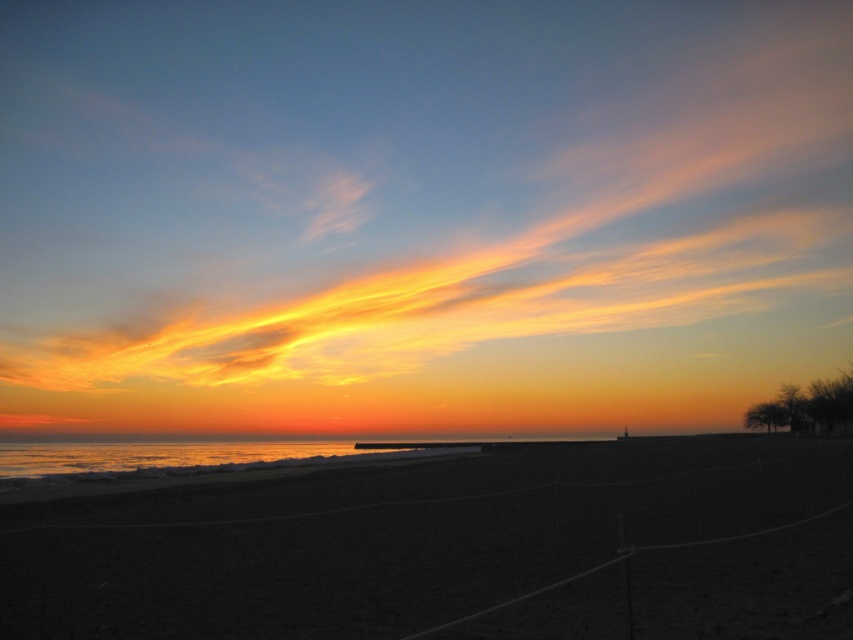
Question: Does golden translucent clouds at upper center appear on the right side of dark sand at center?

Choices:
 (A) no
 (B) yes

Answer: (A)

Question: Which point is farther to the camera?

Choices:
 (A) (711, 570)
 (B) (480, 196)

Answer: (B)

Question: In this image, where is golden translucent clouds at upper center located relative to dark sand at center?

Choices:
 (A) left
 (B) right

Answer: (A)

Question: Which point is farther from the camera taking this photo?

Choices:
 (A) (703, 252)
 (B) (659, 596)

Answer: (A)

Question: In this image, where is golden translucent clouds at upper center located relative to dark sand at center?

Choices:
 (A) below
 (B) above

Answer: (B)